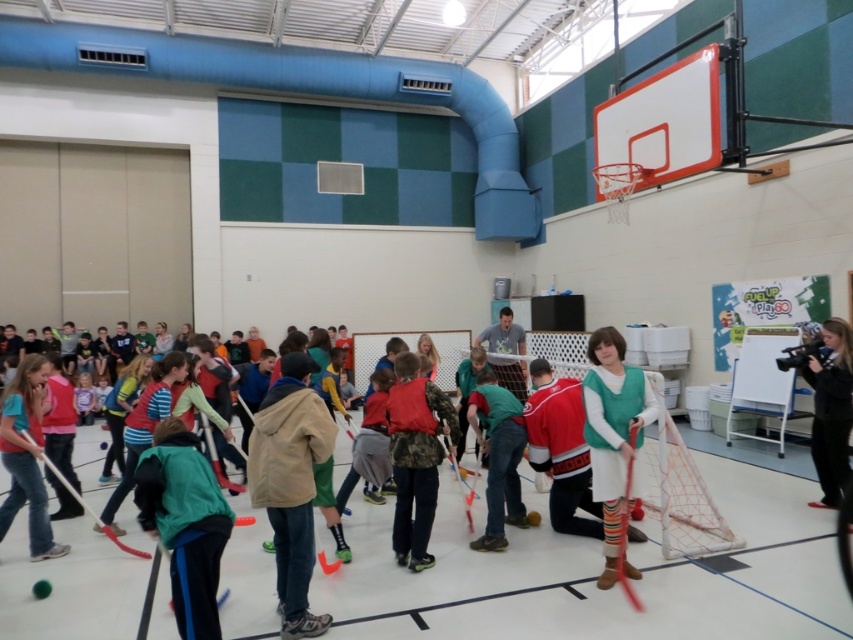
You are a physical education teacher observing the hockey game. You need to determine which item is more suitable to place in a narrow storage compartment. The compartment can only accommodate items with a thickness of 3 cm or less. Based on the scene, which object between the tan fabric jacket at center and the rubber hockey stick at center would fit better?

The tan fabric jacket at center is thinner than the rubber hockey stick at center, so the tan fabric jacket at center would fit better in the narrow storage compartment since it meets the 3 cm thickness requirement.

You are standing at the origin point in the gymnasium and see two points marked on the wall. The first point is at coordinates point (x=496, y=547) and the second point is at coordinates point (x=825, y=408). Which point is closer to you?

Point (x=496, y=547) is in front of point (x=825, y=408), so it is closer to you.